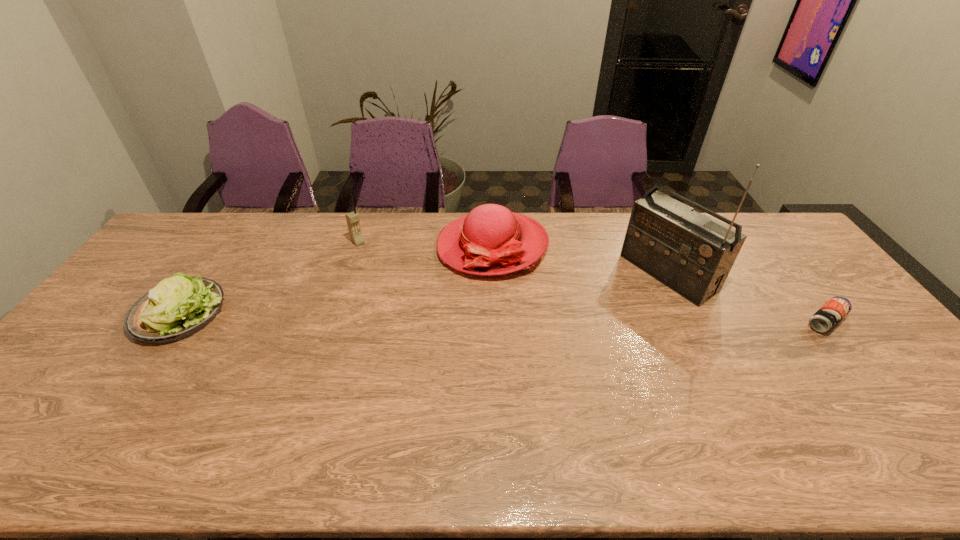
I want to click on vacant space located 0.320m on the front of the cellular telephone, where the keypad is located, so click(415, 296).

Where is `radio receiver positioned at the far edge`? This screenshot has width=960, height=540. radio receiver positioned at the far edge is located at coordinates (692, 254).

The image size is (960, 540). Identify the location of hat that is at the far edge. click(491, 240).

Where is `cellular telephone present at the far edge`? The width and height of the screenshot is (960, 540). cellular telephone present at the far edge is located at coordinates (352, 218).

Locate an element on the screen. object that is positioned at the left edge is located at coordinates (178, 307).

Identify the location of object at the right edge. Image resolution: width=960 pixels, height=540 pixels. (830, 314).

Find the location of a particular element. vacant space at the far edge of the desktop is located at coordinates (225, 225).

At what (x,y) coordinates should I click in order to perform the action: click on vacant space at the near edge. Please return your answer as a coordinate pair (x, y). The width and height of the screenshot is (960, 540). Looking at the image, I should click on (539, 415).

Identify the location of vacant region at the left edge. This screenshot has width=960, height=540. (43, 392).

Where is `vacant position at the right edge of the desktop`? This screenshot has height=540, width=960. vacant position at the right edge of the desktop is located at coordinates (833, 291).